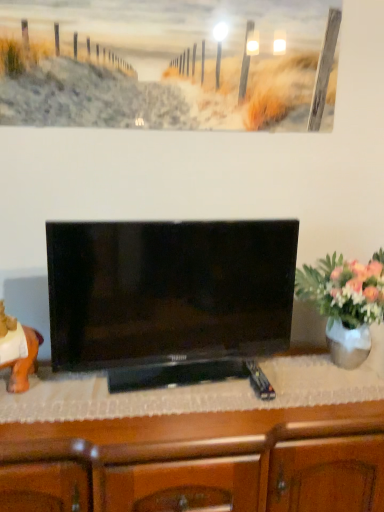
I want to click on free spot in front of orange matte statue at left, so click(x=25, y=415).